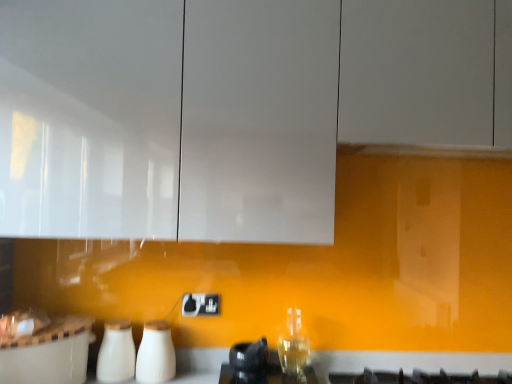
Question: Is white glossy countertop at lower center spatially inside black plastic electric outlet at center, or outside of it?

Choices:
 (A) outside
 (B) inside

Answer: (A)

Question: In terms of height, does white glossy countertop at lower center look taller or shorter compared to black plastic electric outlet at center?

Choices:
 (A) tall
 (B) short

Answer: (A)

Question: Based on their relative distances, which object is farther from the white glossy milk bottles at lower center, the 1th appliance positioned from the left?

Choices:
 (A) white glossy cabinet at upper center
 (B) white glossy countertop at lower center
 (C) white glossy salt and pepper shakers at center, the 2th appliance positioned from the left
 (D) black plastic electric outlet at center

Answer: (A)

Question: Which object is positioned farthest from the white glossy salt and pepper shakers at center, the first appliance in the right-to-left sequence?

Choices:
 (A) white glossy cabinet at upper center
 (B) white glossy milk bottles at lower center, which is counted as the second appliance, starting from the right
 (C) white glossy countertop at lower center
 (D) black plastic electric outlet at center

Answer: (A)